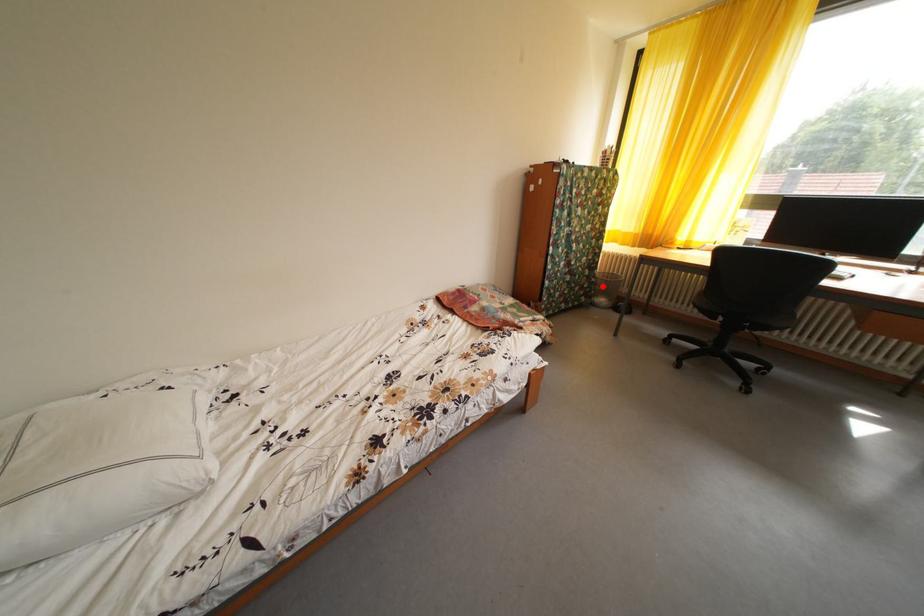
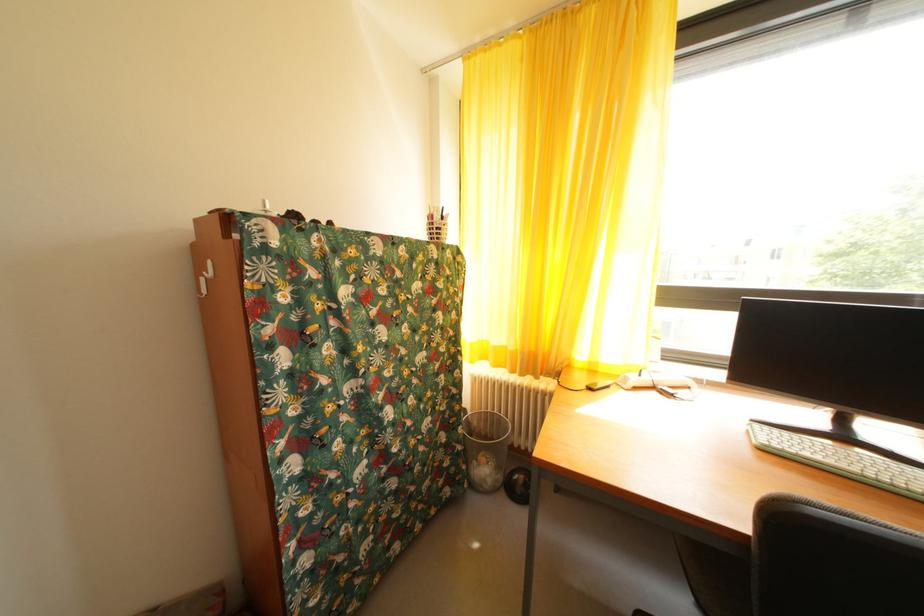
Question: I am providing you with two images of the same scene from different viewpoints. Image1 has a red point marked. In image2, the corresponding 3D location appears at what relative position? Reply with the corresponding letter.

Choices:
 (A) Closer
 (B) Farther

Answer: (A)